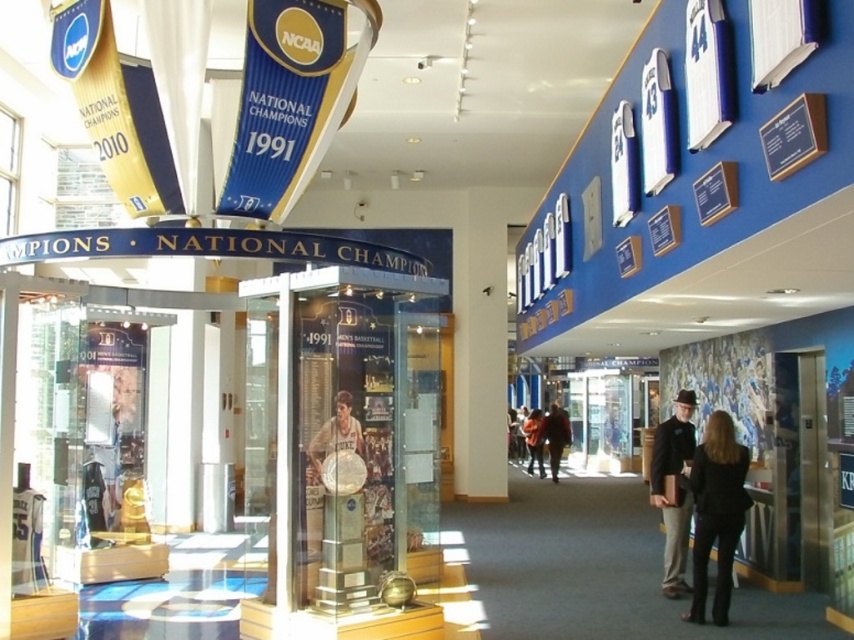
Question: Can you confirm if matte gold trophy at center is smaller than dark brown leather jacket at center?

Choices:
 (A) no
 (B) yes

Answer: (B)

Question: Which object is the closest to the black leather jacket at center?

Choices:
 (A) matte gold trophy at center
 (B) black leather jacket at lower right
 (C) dark brown leather jacket at center

Answer: (B)

Question: Which of these objects is positioned farthest from the orange fabric jacket at center?

Choices:
 (A) matte gold trophy at center
 (B) dark brown leather jacket at center
 (C) black leather jacket at lower right

Answer: (A)

Question: Which of these objects is positioned closest to the orange fabric jacket at center?

Choices:
 (A) matte gold trophy at center
 (B) black leather jacket at lower right
 (C) black leather jacket at center
 (D) dark brown leather jacket at center

Answer: (D)

Question: Is dark brown leather jacket at center below orange fabric jacket at center?

Choices:
 (A) yes
 (B) no

Answer: (B)

Question: Can you confirm if black leather jacket at center is wider than orange fabric jacket at center?

Choices:
 (A) no
 (B) yes

Answer: (B)